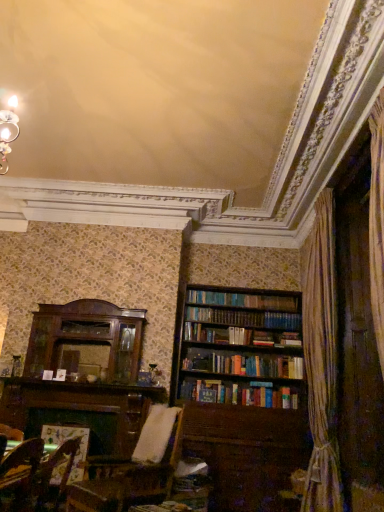
The width and height of the screenshot is (384, 512). Describe the element at coordinates (243, 393) in the screenshot. I see `wooden bookcase at right` at that location.

Find the location of a particular element. The image size is (384, 512). wooden bookcase at right is located at coordinates 243,393.

Where is `wooden bookcase at right`? Image resolution: width=384 pixels, height=512 pixels. wooden bookcase at right is located at coordinates (243, 393).